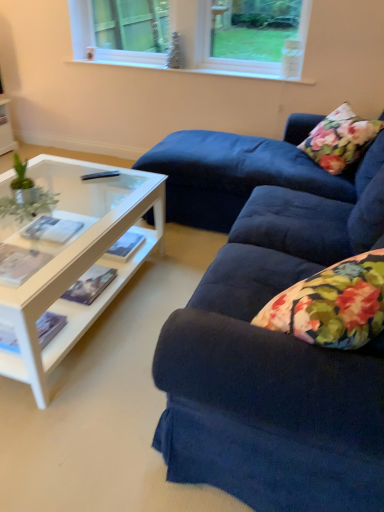
Question: Does white plastic window at upper center have a greater height compared to floral fabric pillow at upper right?

Choices:
 (A) no
 (B) yes

Answer: (A)

Question: From a real-world perspective, is white plastic window at upper center positioned under floral fabric pillow at upper right based on gravity?

Choices:
 (A) yes
 (B) no

Answer: (B)

Question: Is white plastic window at upper center to the left of floral fabric pillow at upper right from the viewer's perspective?

Choices:
 (A) yes
 (B) no

Answer: (A)

Question: Is white plastic window at upper center oriented towards floral fabric pillow at upper right?

Choices:
 (A) no
 (B) yes

Answer: (A)

Question: Does white plastic window at upper center have a lesser width compared to floral fabric pillow at upper right?

Choices:
 (A) yes
 (B) no

Answer: (A)

Question: Considering the positions of point (34, 203) and point (377, 121), is point (34, 203) closer or farther from the camera than point (377, 121)?

Choices:
 (A) farther
 (B) closer

Answer: (B)

Question: Is green leafy plant at left inside the boundaries of floral fabric pillow at upper right, or outside?

Choices:
 (A) inside
 (B) outside

Answer: (B)

Question: Considering the relative positions of green leafy plant at left and floral fabric pillow at upper right in the image provided, is green leafy plant at left to the left or to the right of floral fabric pillow at upper right?

Choices:
 (A) left
 (B) right

Answer: (A)

Question: Looking at the image, does green leafy plant at left seem bigger or smaller compared to floral fabric pillow at upper right?

Choices:
 (A) big
 (B) small

Answer: (B)

Question: Is white plastic window at upper center wider or thinner than black plastic remote control at center?

Choices:
 (A) wide
 (B) thin

Answer: (A)

Question: From the image's perspective, is white plastic window at upper center positioned above or below black plastic remote control at center?

Choices:
 (A) below
 (B) above

Answer: (B)

Question: Is white plastic window at upper center in front of or behind black plastic remote control at center in the image?

Choices:
 (A) behind
 (B) front

Answer: (A)

Question: Visually, is white plastic window at upper center positioned to the left or to the right of black plastic remote control at center?

Choices:
 (A) left
 (B) right

Answer: (B)

Question: From the image's perspective, is green leafy plant at left located above or below velvet blue couch at right?

Choices:
 (A) above
 (B) below

Answer: (A)

Question: Does point (3, 200) appear closer or farther from the camera than point (296, 228)?

Choices:
 (A) farther
 (B) closer

Answer: (B)